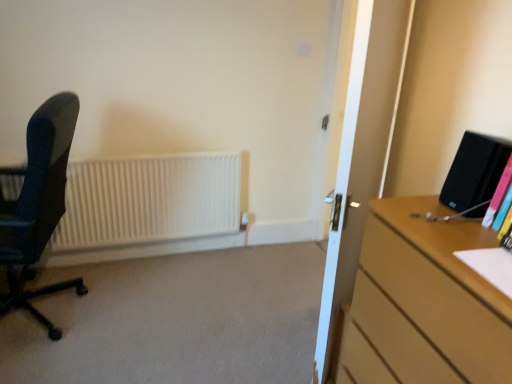
What are the coordinates of `vacant area located to the right-hand side of matte black office chair at left` in the screenshot? It's located at (143, 309).